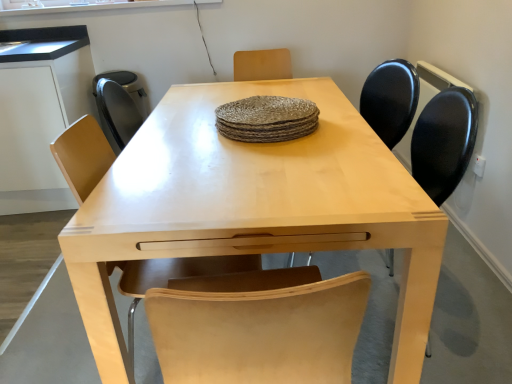
Question: From a real-world perspective, is rustic woven placemat at center beneath light wood table at center?

Choices:
 (A) yes
 (B) no

Answer: (B)

Question: Does rustic woven placemat at center have a greater height compared to light wood table at center?

Choices:
 (A) yes
 (B) no

Answer: (B)

Question: Is rustic woven placemat at center in contact with light wood table at center?

Choices:
 (A) no
 (B) yes

Answer: (A)

Question: Is rustic woven placemat at center positioned in front of light wood table at center?

Choices:
 (A) yes
 (B) no

Answer: (B)

Question: Considering the relative sizes of rustic woven placemat at center and light wood table at center in the image provided, is rustic woven placemat at center smaller than light wood table at center?

Choices:
 (A) no
 (B) yes

Answer: (B)

Question: Is rustic woven placemat at center positioned with its back to light wood table at center?

Choices:
 (A) yes
 (B) no

Answer: (B)

Question: Is light brown wood chair at center, the 2th chair in the right-to-left sequence, thinner than rustic woven placemat at center?

Choices:
 (A) yes
 (B) no

Answer: (B)

Question: Is the position of light brown wood chair at center, the first chair from the left, less distant than that of rustic woven placemat at center?

Choices:
 (A) yes
 (B) no

Answer: (A)

Question: From the image's perspective, is light brown wood chair at center, the first chair from the left, on rustic woven placemat at center?

Choices:
 (A) no
 (B) yes

Answer: (A)

Question: Is rustic woven placemat at center inside light brown wood chair at center, the first chair from the left?

Choices:
 (A) yes
 (B) no

Answer: (B)

Question: Is light brown wood chair at center, the first chair from the left, located outside rustic woven placemat at center?

Choices:
 (A) yes
 (B) no

Answer: (A)

Question: Is light brown wood chair at center, the first chair from the left, wider than rustic woven placemat at center?

Choices:
 (A) no
 (B) yes

Answer: (B)

Question: Is matte black chair at center, the first chair viewed from the right, thinner than rustic woven placemat at center?

Choices:
 (A) yes
 (B) no

Answer: (B)